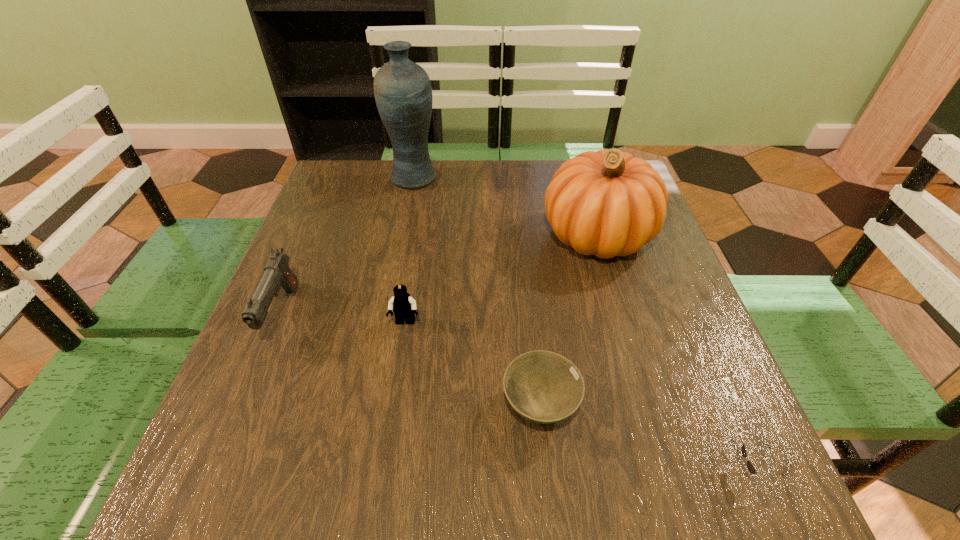
This screenshot has width=960, height=540. What are the coordinates of `the tallest object` in the screenshot? It's located at (402, 89).

Find the location of a particular element. vase is located at coordinates (402, 89).

You are a GUI agent. You are given a task and a screenshot of the screen. Output one action in this format:
    pyautogui.click(x=<x>, y=<y>)
    Task: Click on the second tallest object
    Image resolution: width=960 pixels, height=540 pixels.
    Given the screenshot: What is the action you would take?
    pyautogui.click(x=607, y=203)

Where is `the second farthest object`? This screenshot has width=960, height=540. the second farthest object is located at coordinates (607, 203).

At what (x,y) coordinates should I click in order to perform the action: click on gun. Please return your answer as a coordinate pair (x, y). Image resolution: width=960 pixels, height=540 pixels. Looking at the image, I should click on (277, 273).

Identify the location of the third tallest object. (277, 273).

Find the location of a particular element. the fourth tallest object is located at coordinates click(x=404, y=307).

At what (x,y) coordinates should I click in order to perform the action: click on the second shortest object. Please return your answer as a coordinate pair (x, y). The width and height of the screenshot is (960, 540). Looking at the image, I should click on (544, 387).

Locate an element on the screen. The width and height of the screenshot is (960, 540). the shortest object is located at coordinates pos(750,466).

Identify the location of vacant space located 0.110m on the left of the vase. (349, 178).